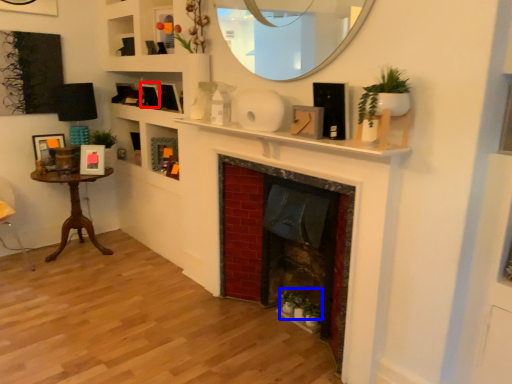
Question: Which object is further to the camera taking this photo, picture frame (highlighted by a red box) or plant (highlighted by a blue box)?

Choices:
 (A) picture frame
 (B) plant

Answer: (A)